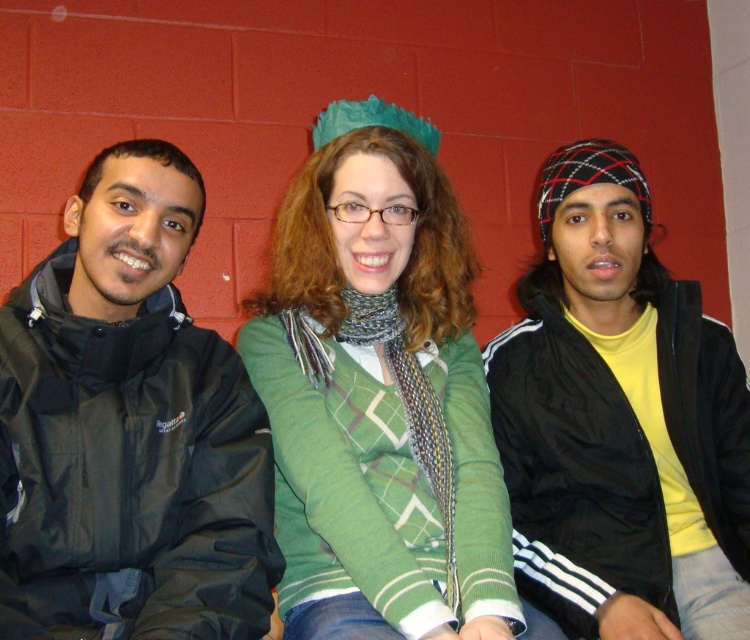
Between green knitted sweater at center and black matte jacket at right, which one has less height?

green knitted sweater at center is shorter.

The height and width of the screenshot is (640, 750). What are the coordinates of `green knitted sweater at center` in the screenshot? It's located at (380, 387).

This screenshot has width=750, height=640. I want to click on green knitted sweater at center, so (380, 387).

Can you confirm if matte black jacket at left is smaller than green knitted sweater at center?

Yes, matte black jacket at left is smaller than green knitted sweater at center.

Is matte black jacket at left further to camera compared to green knitted sweater at center?

No.

What do you see at coordinates (129, 428) in the screenshot?
I see `matte black jacket at left` at bounding box center [129, 428].

Identify the location of matte black jacket at left. (129, 428).

Can you confirm if matte black jacket at left is positioned to the left of black matte jacket at right?

Correct, you'll find matte black jacket at left to the left of black matte jacket at right.

Is matte black jacket at left positioned at the back of black matte jacket at right?

That is False.

Is point (214, 397) farther from camera compared to point (630, 301)?

No, it is not.

I want to click on matte black jacket at left, so click(129, 428).